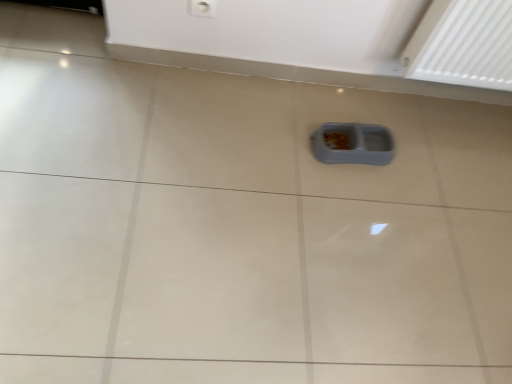
Identify the location of free space in front of gray plastic food container at center. The height and width of the screenshot is (384, 512). (341, 192).